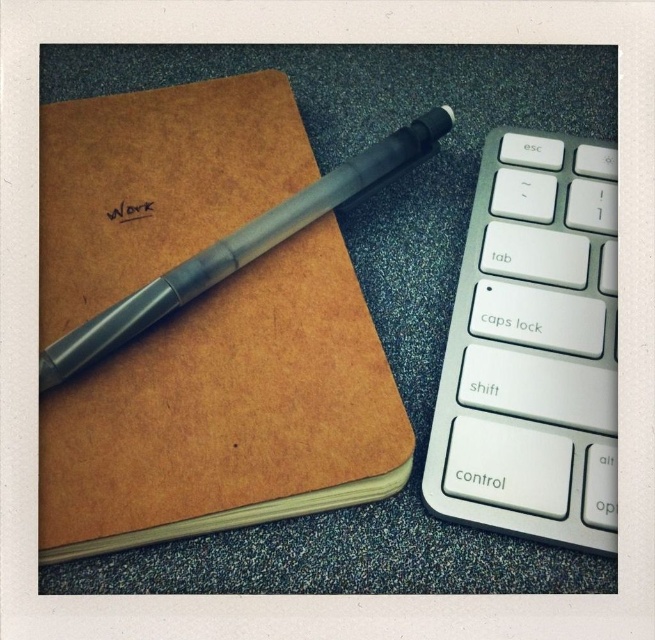
Question: Among these objects, which one is farthest from the camera?

Choices:
 (A) silver metallic keyboard at right
 (B) brown leather notebook at upper left

Answer: (A)

Question: Is brown leather notebook at upper left below silver metallic keyboard at right?

Choices:
 (A) yes
 (B) no

Answer: (B)

Question: Which object appears closest to the camera in this image?

Choices:
 (A) silver metallic keyboard at right
 (B) brown leather notebook at upper left

Answer: (B)

Question: Does brown leather notebook at upper left appear on the left side of silver metallic keyboard at right?

Choices:
 (A) yes
 (B) no

Answer: (A)

Question: Considering the relative positions of brown leather notebook at upper left and silver metallic keyboard at right in the image provided, where is brown leather notebook at upper left located with respect to silver metallic keyboard at right?

Choices:
 (A) right
 (B) left

Answer: (B)